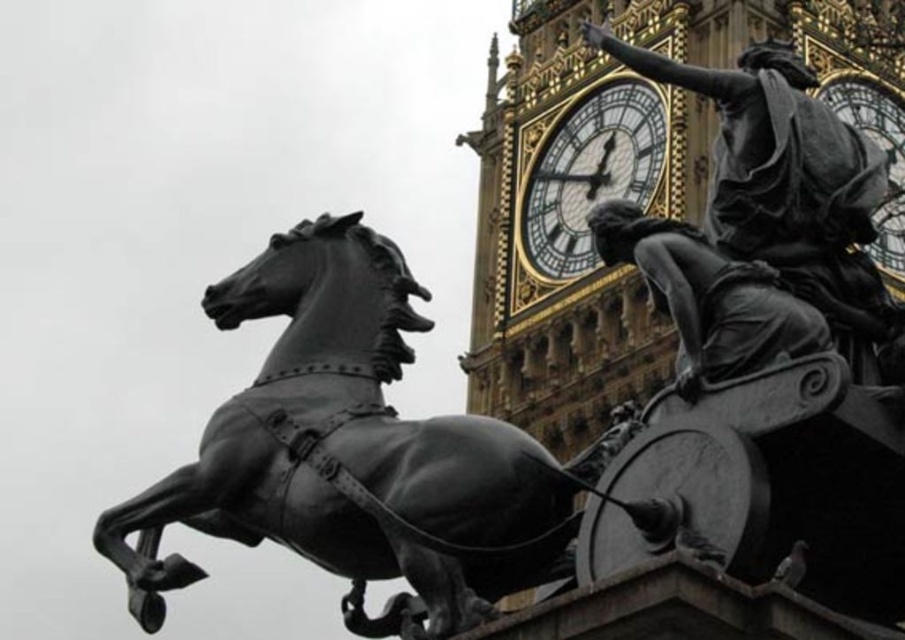
Between polished bronze horse at center and polished bronze statue at upper right, which one has less height?

polished bronze statue at upper right

Is point (176, 515) behind point (627, 243)?

Yes.

Is point (505, 433) closer to camera compared to point (782, 320)?

No.

Identify the location of polished bronze horse at center. Image resolution: width=905 pixels, height=640 pixels. (349, 449).

Which is below, polished bronze statue at upper right or gold/brass clock at upper center?

polished bronze statue at upper right is lower down.

Who is more distant from viewer, (779, 307) or (532, 260)?

Positioned behind is point (532, 260).

Who is more distant from viewer, (x=763, y=285) or (x=629, y=160)?

The point (x=629, y=160) is behind.

This screenshot has width=905, height=640. What are the coordinates of `polished bronze statue at upper right` in the screenshot? It's located at (708, 296).

Is point (610, 104) less distant than point (898, 138)?

No, (610, 104) is behind (898, 138).

Can you confirm if gold/brass clock at upper center is thinner than gold metallic clock at upper right?

No, gold/brass clock at upper center is not thinner than gold metallic clock at upper right.

Does point (646, 134) come closer to viewer compared to point (882, 268)?

No.

The image size is (905, 640). Find the location of `gold/brass clock at upper center`. gold/brass clock at upper center is located at coordinates (589, 172).